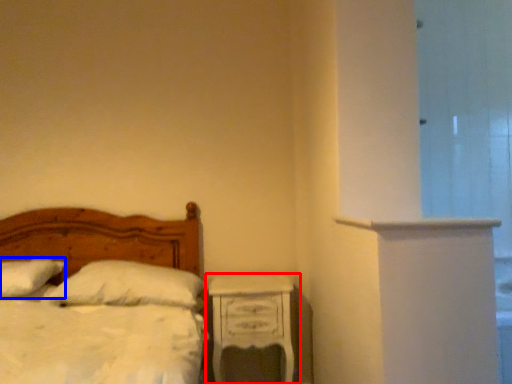
Question: Which object appears closest to the camera in this image, nightstand (highlighted by a red box) or pillow (highlighted by a blue box)?

Choices:
 (A) nightstand
 (B) pillow

Answer: (B)